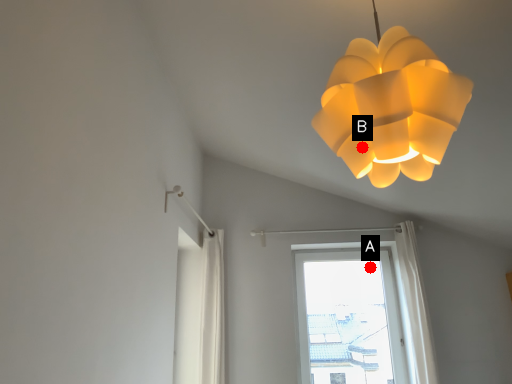
Question: Two points are circled on the image, labeled by A and B beside each circle. Which of the following is the farthest from the observer?

Choices:
 (A) A is further
 (B) B is further

Answer: (A)